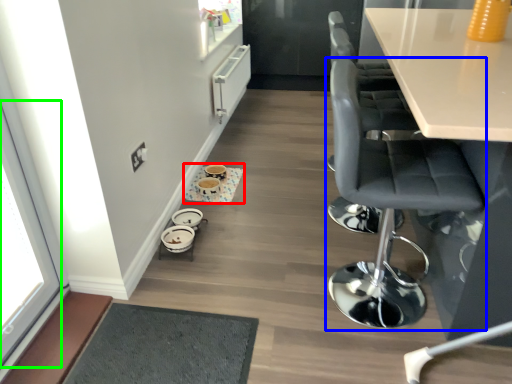
Question: Which object is positioned farthest from round table (highlighted by a red box)? Select from chair (highlighted by a blue box) and window (highlighted by a green box).

Choices:
 (A) chair
 (B) window

Answer: (A)